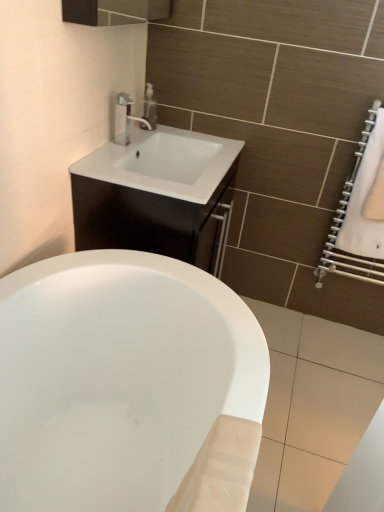
Question: Does white fabric towel at right appear on the left side of white glossy cabinet at upper center?

Choices:
 (A) yes
 (B) no

Answer: (B)

Question: Is white fabric towel at right positioned beyond the bounds of white glossy cabinet at upper center?

Choices:
 (A) no
 (B) yes

Answer: (B)

Question: Does white fabric towel at right have a smaller size compared to white glossy cabinet at upper center?

Choices:
 (A) no
 (B) yes

Answer: (B)

Question: From the image's perspective, is white fabric towel at right on top of white glossy cabinet at upper center?

Choices:
 (A) no
 (B) yes

Answer: (B)

Question: From the image's perspective, would you say white fabric towel at right is shown under white glossy cabinet at upper center?

Choices:
 (A) no
 (B) yes

Answer: (A)

Question: From a real-world perspective, is white fabric towel at right positioned over white glossy cabinet at upper center based on gravity?

Choices:
 (A) no
 (B) yes

Answer: (B)

Question: Does satin nickel faucet at upper center have a greater height compared to matte silver soap dispenser at upper center?

Choices:
 (A) no
 (B) yes

Answer: (B)

Question: From a real-world perspective, is satin nickel faucet at upper center physically above matte silver soap dispenser at upper center?

Choices:
 (A) no
 (B) yes

Answer: (B)

Question: Is satin nickel faucet at upper center smaller than matte silver soap dispenser at upper center?

Choices:
 (A) no
 (B) yes

Answer: (A)

Question: Does satin nickel faucet at upper center turn towards matte silver soap dispenser at upper center?

Choices:
 (A) no
 (B) yes

Answer: (A)

Question: Considering the relative sizes of satin nickel faucet at upper center and matte silver soap dispenser at upper center in the image provided, is satin nickel faucet at upper center wider than matte silver soap dispenser at upper center?

Choices:
 (A) yes
 (B) no

Answer: (A)

Question: Can you confirm if satin nickel faucet at upper center is positioned to the left of matte silver soap dispenser at upper center?

Choices:
 (A) no
 (B) yes

Answer: (B)

Question: From a real-world perspective, is satin nickel faucet at upper center over white fabric towel at right?

Choices:
 (A) no
 (B) yes

Answer: (B)